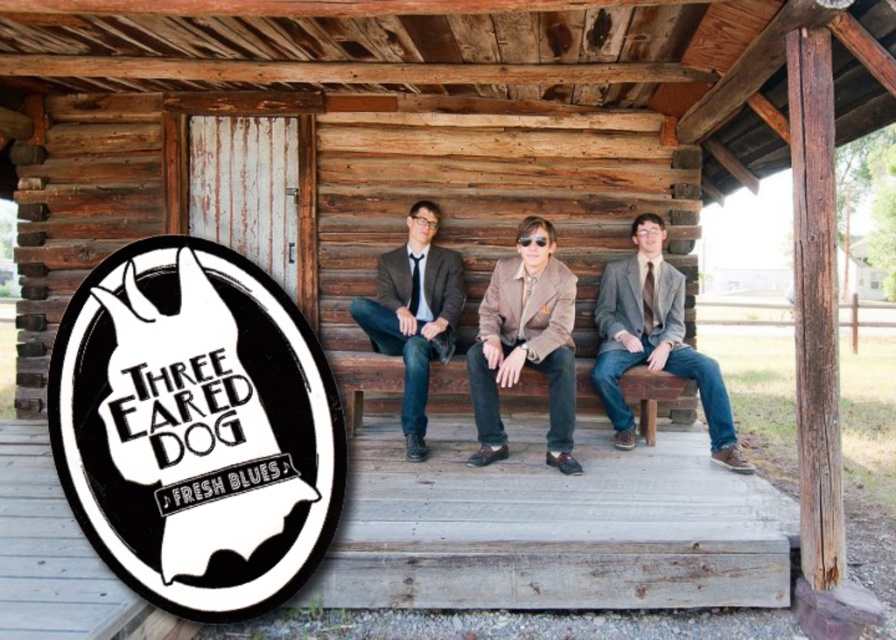
Does black paper sign at left have a greater height compared to matte gray blazer at center?

Incorrect, black paper sign at left's height is not larger of matte gray blazer at center's.

Is black paper sign at left shorter than matte gray blazer at center?

Indeed, black paper sign at left has a lesser height compared to matte gray blazer at center.

In order to click on black paper sign at left in this screenshot , I will do `click(196, 428)`.

Can you confirm if brown suede jacket at center is smaller than brown wooden bench at center?

Incorrect, brown suede jacket at center is not smaller in size than brown wooden bench at center.

Which is more to the left, brown suede jacket at center or brown wooden bench at center?

Positioned to the left is brown suede jacket at center.

Measure the distance between point (571, 376) and camera.

Point (571, 376) and camera are 4.16 meters apart from each other.

Identify the location of brown suede jacket at center. This screenshot has height=640, width=896. (524, 342).

Is matte gray suit at center to the right of matte gray blazer at center from the viewer's perspective?

Indeed, matte gray suit at center is positioned on the right side of matte gray blazer at center.

Who is higher up, matte gray suit at center or matte gray blazer at center?

matte gray blazer at center

You are a GUI agent. You are given a task and a screenshot of the screen. Output one action in this format:
    pyautogui.click(x=<x>, y=<y>)
    Task: Click on the matte gray suit at center
    
    Given the screenshot: What is the action you would take?
    pyautogui.click(x=653, y=340)

Locate an element on the screen. The width and height of the screenshot is (896, 640). matte gray suit at center is located at coordinates (653, 340).